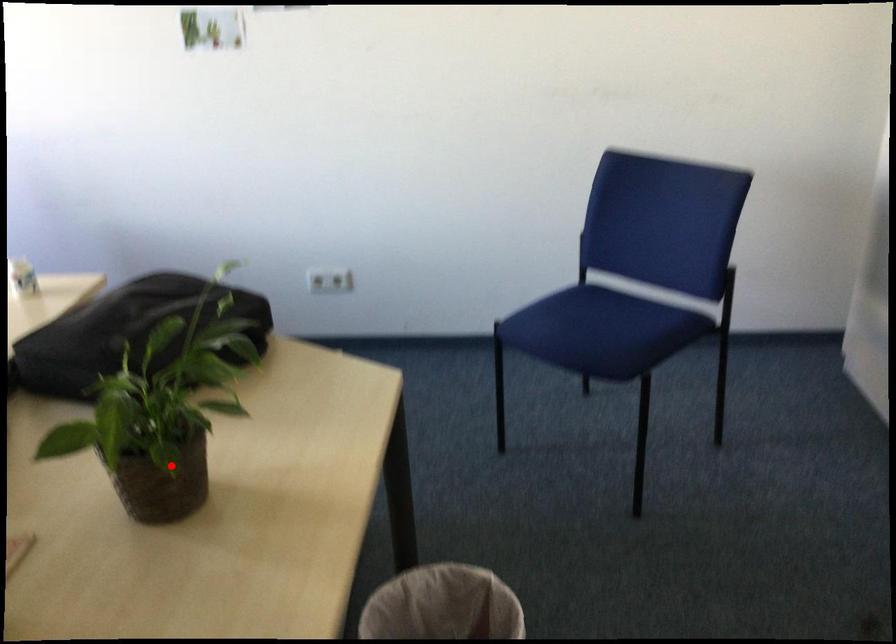
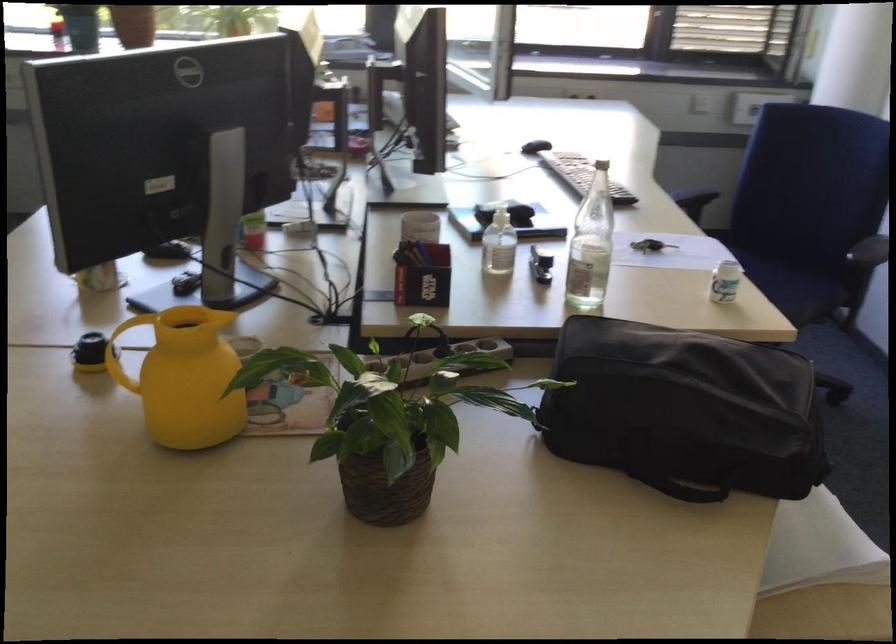
Where in the second image is the point corresponding to the highlighted location from the first image?

(383, 484)